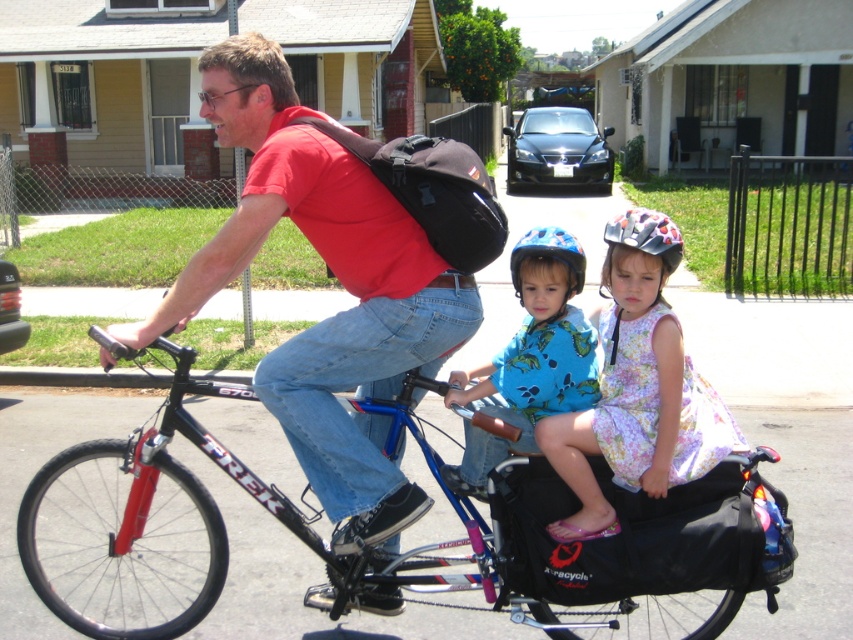
Can you confirm if blue cotton shirt at center is thinner than blue matte helmet at center?

No.

Identify the location of blue cotton shirt at center. (529, 358).

Between floral dress at center and blue matte helmet at center, which one has more height?

Standing taller between the two is floral dress at center.

Can you confirm if floral dress at center is bigger than blue matte helmet at center?

Yes, floral dress at center is bigger than blue matte helmet at center.

Is point (587, 531) positioned after point (556, 236)?

No, it is not.

Identify the location of floral dress at center. (637, 387).

Describe the element at coordinates (637, 387) in the screenshot. I see `floral dress at center` at that location.

Is point (724, 445) in front of point (395, 166)?

No.

Between point (618, 227) and point (473, 253), which one is positioned in front?

Point (618, 227)

Image resolution: width=853 pixels, height=640 pixels. Identify the location of floral dress at center. (637, 387).